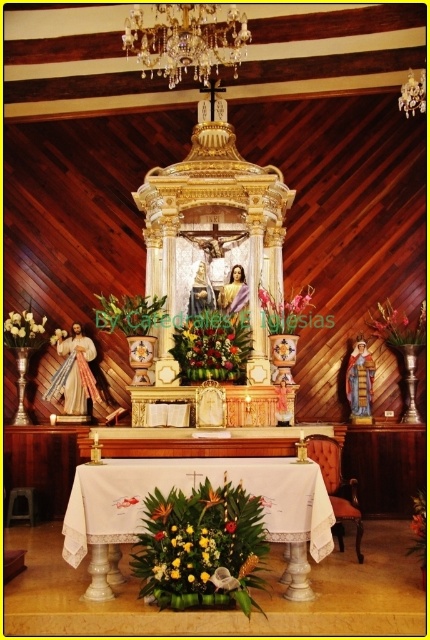
Who is positioned more to the left, white lace tablecloth at center or green leafy plant at center?

green leafy plant at center

Who is more distant from viewer, (64, 538) or (242, 342)?

Point (242, 342)

The image size is (430, 640). Find the location of `white lace tablecloth at center`. white lace tablecloth at center is located at coordinates (187, 492).

From the picture: Can you confirm if green leafy plant at center is taller than yellow matte flower at center?

Yes.

Does point (190, 355) come farther from viewer compared to point (232, 529)?

Yes, it is behind point (232, 529).

At what (x,y) coordinates should I click in order to perform the action: click on green leafy plant at center. Please return your answer as a coordinate pair (x, y). Looking at the image, I should click on (211, 348).

Who is higher up, white lace tablecloth at center or yellow fabric flower at center?

white lace tablecloth at center

Between white lace tablecloth at center and yellow fabric flower at center, which one has more height?

Standing taller between the two is white lace tablecloth at center.

Does point (248, 490) lie behind point (199, 573)?

Yes, point (248, 490) is farther from viewer.

This screenshot has width=430, height=640. What are the coordinates of `white lace tablecloth at center` in the screenshot? It's located at (187, 492).